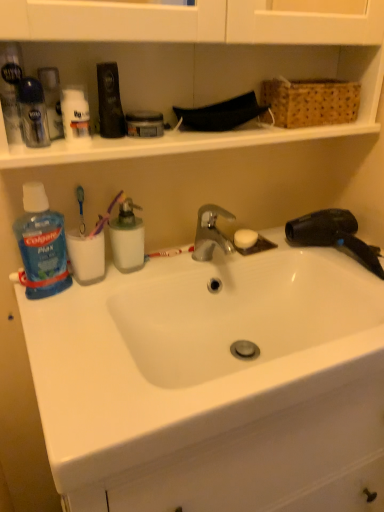
Question: Is white matte deodorant at upper left, arranged as the third toiletry when viewed from the left, spatially inside blue plastic mouthwash at left, which is the 1th cleaning product in left-to-right order, or outside of it?

Choices:
 (A) outside
 (B) inside

Answer: (A)

Question: Visually, is white matte deodorant at upper left, the 1th toiletry viewed from the right, positioned to the left or to the right of blue plastic mouthwash at left, the second cleaning product viewed from the right?

Choices:
 (A) left
 (B) right

Answer: (B)

Question: Which object is the closest to the woven brown basket at upper right?

Choices:
 (A) clear plastic shaving cream canister at upper left, acting as the 2th toiletry starting from the left
 (B) translucent plastic container at center, acting as the 1th cleaning product starting from the right
 (C) white matte deodorant at upper left, the 1th toiletry viewed from the right
 (D) blue plastic mouthwash at left, which is the 1th cleaning product in left-to-right order
 (E) white ceramic sink at center

Answer: (E)

Question: Which is nearer to the blue plastic mouthwash at left, which is the 1th cleaning product in left-to-right order?

Choices:
 (A) white ceramic sink at center
 (B) woven brown basket at upper right
 (C) translucent plastic deodorant at upper left, which appears as the third toiletry when viewed from the right
 (D) white matte deodorant at upper left, arranged as the third toiletry when viewed from the left
 (E) clear plastic shaving cream canister at upper left, the second toiletry in the right-to-left sequence

Answer: (E)